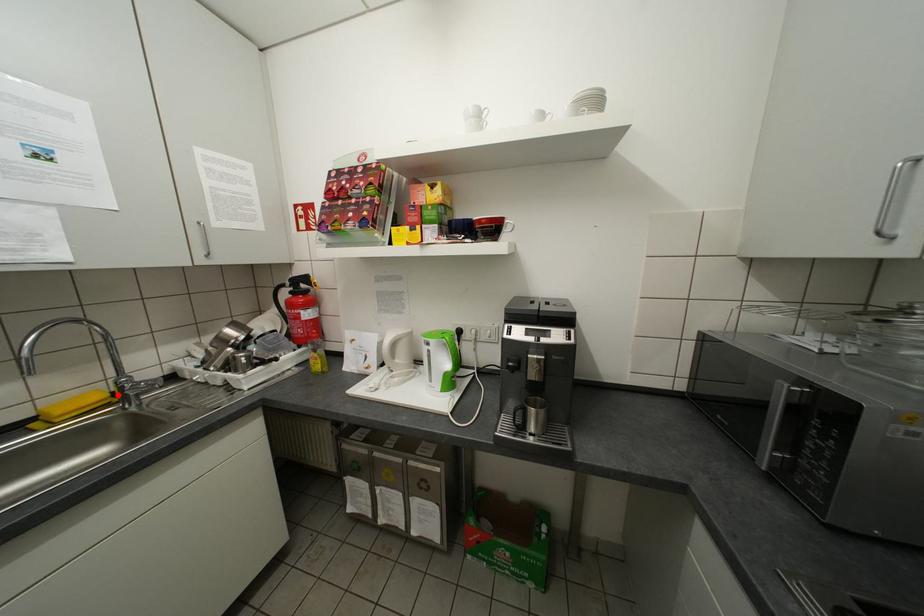
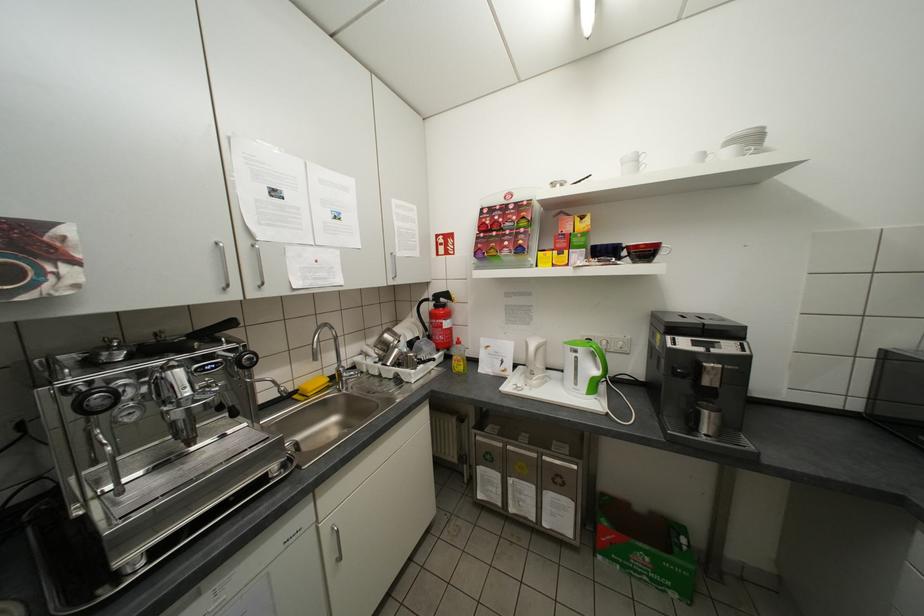
Locate, in the second image, the point that corresponds to the highlighted location in the first image.

(336, 379)